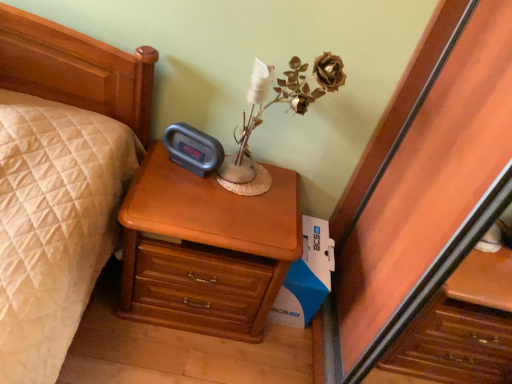
Image resolution: width=512 pixels, height=384 pixels. I want to click on vacant space in front of white cardboard box at lower right, so click(x=273, y=355).